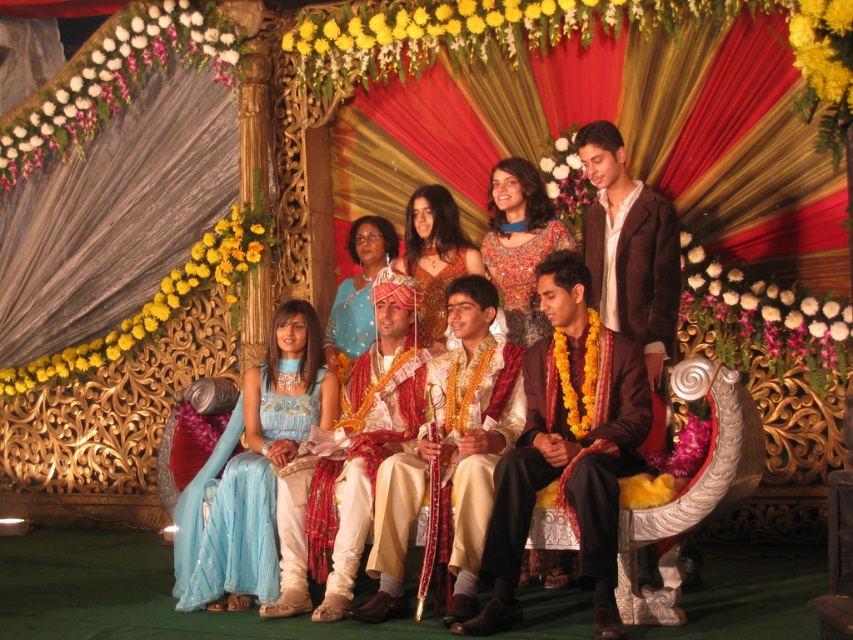
You are a photographer at the wedding and want to capture the embroidered silk blouse at center and the shiny gold dress at center. Which clothing item is covering part of the other?

The embroidered silk blouse at center is positioned over the shiny gold dress at center, so it is covering part of the shiny gold dress at center.

You are a photographer at the wedding and want to ensure both the silk white kurta at center and the matte gold jewelry at center are clearly visible in the photo. Which object should you focus on first to ensure it doesn

The silk white kurta at center has a lesser height compared to matte gold jewelry at center. Therefore, you should focus on the matte gold jewelry at center first since it is taller and might be more prominent in the frame.